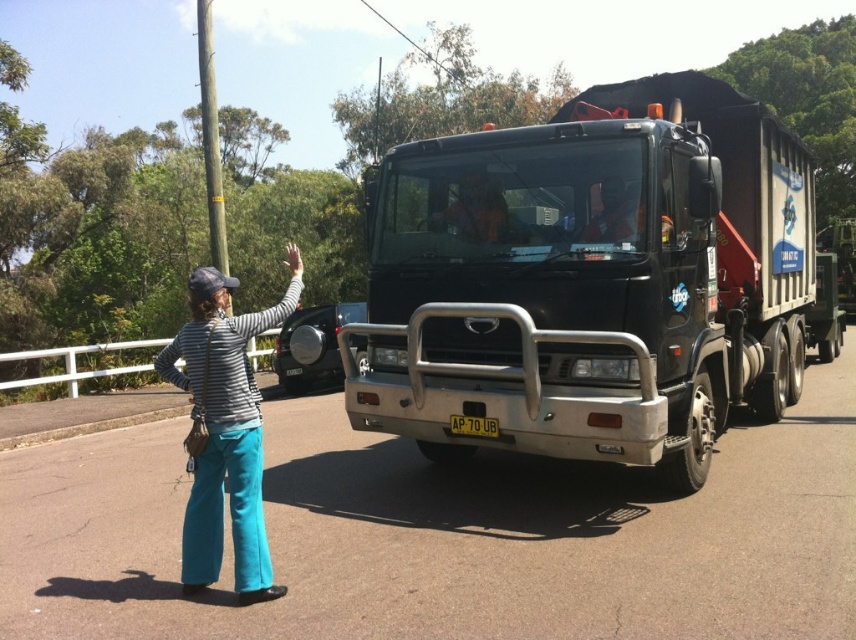
Based on the photo, does black metallic truck at center come in front of yellow plastic license plate at center?

Yes, it is.

Which is in front, point (575, 401) or point (453, 433)?

Point (575, 401) is in front.

What are the coordinates of `black metallic truck at center` in the screenshot? It's located at pos(593,280).

Can you confirm if striped fabric shirt at left is positioned to the left of yellow plastic license plate at center?

Indeed, striped fabric shirt at left is positioned on the left side of yellow plastic license plate at center.

Is point (210, 516) positioned before point (474, 422)?

Yes, point (210, 516) is closer to viewer.

This screenshot has width=856, height=640. Describe the element at coordinates (224, 432) in the screenshot. I see `striped fabric shirt at left` at that location.

At what (x,y) coordinates should I click in order to perform the action: click on striped fabric shirt at left. Please return your answer as a coordinate pair (x, y). This screenshot has width=856, height=640. Looking at the image, I should click on (224, 432).

Can you confirm if black metallic truck at center is shorter than striped fabric shirt at left?

Yes.

Image resolution: width=856 pixels, height=640 pixels. I want to click on black metallic truck at center, so 593,280.

Is point (629, 269) closer to camera compared to point (236, 468)?

No.

Locate an element on the screen. This screenshot has width=856, height=640. black metallic truck at center is located at coordinates (593, 280).